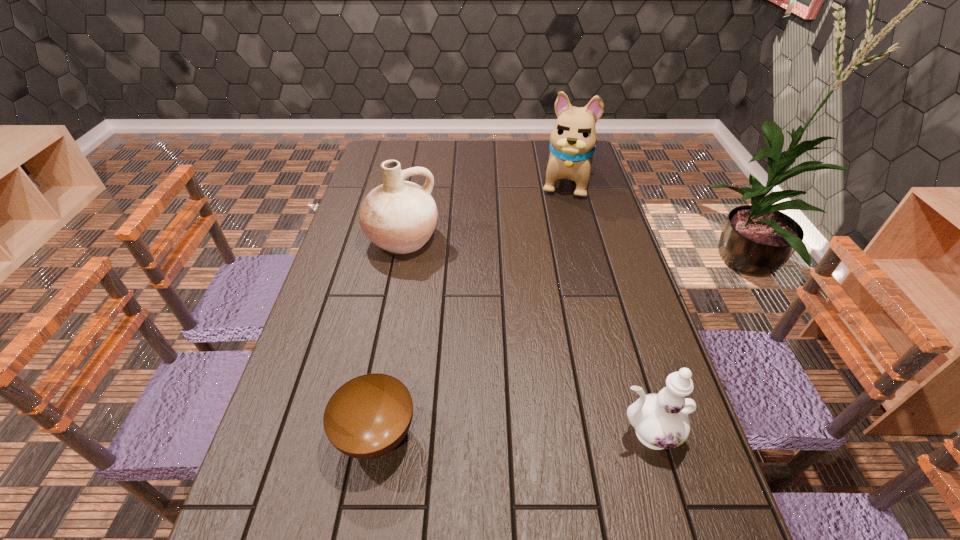
The width and height of the screenshot is (960, 540). What are the coordinates of `free spot between the chinaware and the pottery` in the screenshot? It's located at (524, 336).

Image resolution: width=960 pixels, height=540 pixels. Identify the location of unoccupied area between the shortest object and the pottery. (389, 336).

Find the location of a particular element. This screenshot has height=540, width=960. vacant space in between the pottery and the bowl is located at coordinates (389, 336).

The height and width of the screenshot is (540, 960). Find the location of `free space between the tallest object and the second farthest object`. free space between the tallest object and the second farthest object is located at coordinates (483, 210).

In order to click on unoccupied position between the pottery and the puppy in this screenshot , I will do `click(483, 210)`.

Find the location of a particular element. free space between the tallest object and the chinaware is located at coordinates (605, 307).

Identify which object is located as the nearest to the shortest object. Please provide its 2D coordinates. Your answer should be formatted as a tuple, i.e. [(x, y)], where the tuple contains the x and y coordinates of a point satisfying the conditions above.

[(660, 420)]

At what (x,y) coordinates should I click in order to perform the action: click on object that can be found as the second closest to the shortest object. Please return your answer as a coordinate pair (x, y). Looking at the image, I should click on (399, 216).

Identify the location of free space that satisfies the following two spatial constraints: 1. on the back side of the bowl; 2. on the right side of the farthest object. Image resolution: width=960 pixels, height=540 pixels. (421, 181).

Locate an element on the screen. free space that satisfies the following two spatial constraints: 1. on the back side of the pottery; 2. on the right side of the tallest object is located at coordinates (414, 181).